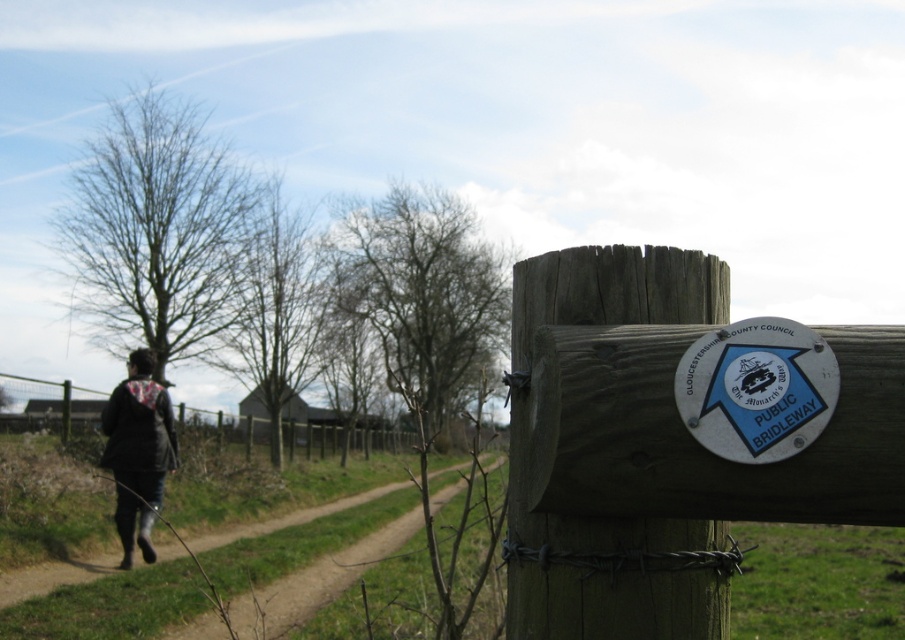
Question: Is white metallic sign at upper center further to camera compared to black leather jacket at lower left?

Choices:
 (A) no
 (B) yes

Answer: (A)

Question: Among these points, which one is nearest to the camera?

Choices:
 (A) (322, 554)
 (B) (119, 522)
 (C) (824, 426)

Answer: (C)

Question: Is white metallic sign at upper center smaller than wooden fence at left?

Choices:
 (A) no
 (B) yes

Answer: (B)

Question: Based on their relative distances, which object is farther from the black leather jacket at lower left?

Choices:
 (A) wooden fence at left
 (B) white metallic sign at upper center
 (C) brown dirt path at lower left

Answer: (A)

Question: Which point is closer to the camera?

Choices:
 (A) green wood signpost at center
 (B) white metallic sign at upper center
 (C) black leather jacket at lower left

Answer: (B)

Question: Can you confirm if brown dirt path at lower left is smaller than black leather jacket at lower left?

Choices:
 (A) yes
 (B) no

Answer: (B)